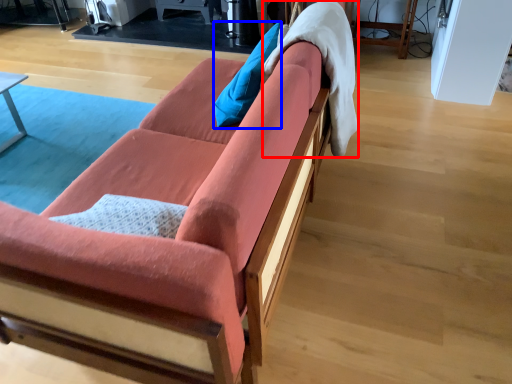
Question: Which object appears farthest to the camera in this image, blanket (highlighted by a red box) or pillow (highlighted by a blue box)?

Choices:
 (A) blanket
 (B) pillow

Answer: (B)